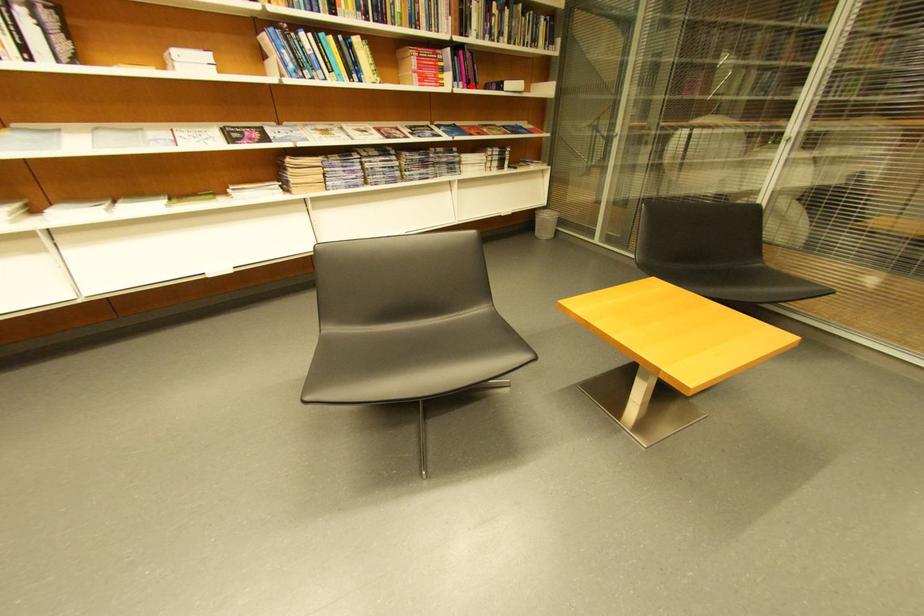
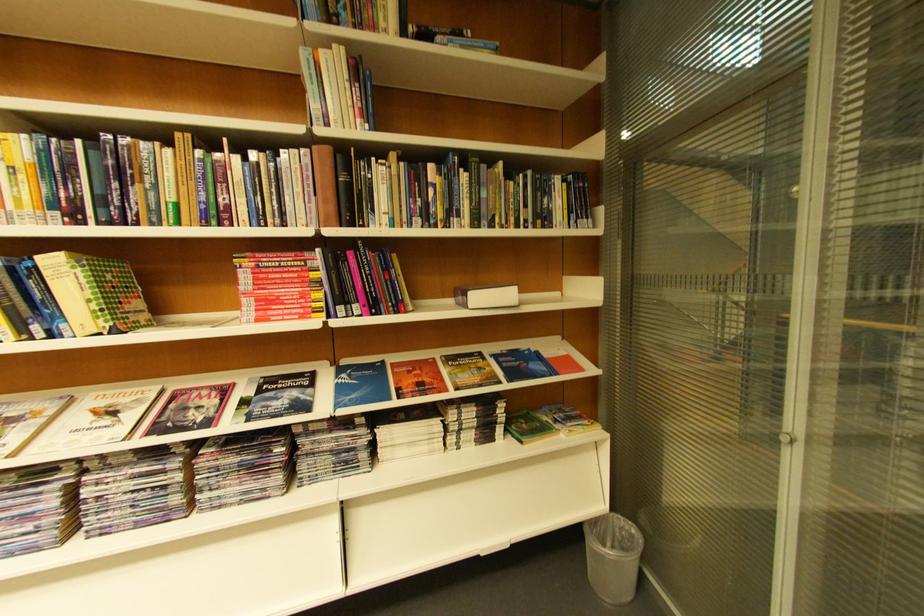
The point at the highlighted location is marked in the first image. Where is the corresponding point in the second image?

(367, 310)